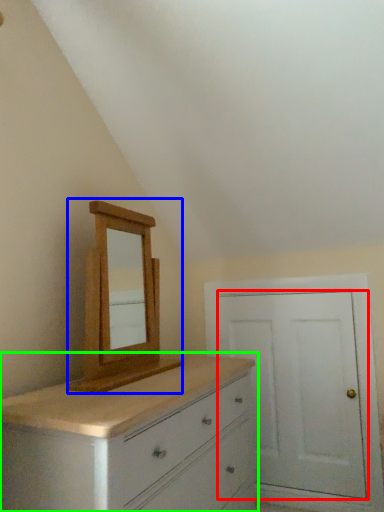
Question: Which object is positioned closest to door (highlighted by a red box)? Select from medicine cabinet (highlighted by a blue box) and chest of drawers (highlighted by a green box).

Choices:
 (A) medicine cabinet
 (B) chest of drawers

Answer: (B)